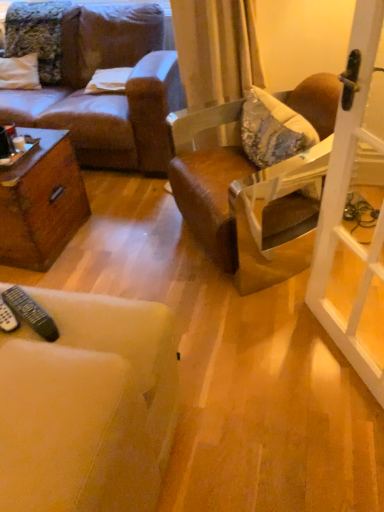
Question: From the image's perspective, would you say brown leather chair at center is positioned over white fabric pillow at upper center?

Choices:
 (A) no
 (B) yes

Answer: (A)

Question: Can white fabric pillow at upper center be found inside brown leather chair at center?

Choices:
 (A) yes
 (B) no

Answer: (B)

Question: Is brown leather chair at center closer to camera compared to white fabric pillow at upper center?

Choices:
 (A) yes
 (B) no

Answer: (A)

Question: Considering the relative positions of brown leather chair at center and white fabric pillow at upper center in the image provided, is brown leather chair at center to the right of white fabric pillow at upper center from the viewer's perspective?

Choices:
 (A) no
 (B) yes

Answer: (B)

Question: From a real-world perspective, is brown leather chair at center positioned over white fabric pillow at upper center based on gravity?

Choices:
 (A) yes
 (B) no

Answer: (B)

Question: Considering their positions, is black plastic remote control at lower left, which is counted as the first remote control, starting from the left, located in front of or behind white glass screen door at right?

Choices:
 (A) behind
 (B) front

Answer: (A)

Question: Considering the positions of black plastic remote control at lower left, the second remote control in the right-to-left sequence, and white glass screen door at right in the image, is black plastic remote control at lower left, the second remote control in the right-to-left sequence, bigger or smaller than white glass screen door at right?

Choices:
 (A) small
 (B) big

Answer: (A)

Question: Considering the positions of point (11, 320) and point (374, 25), is point (11, 320) closer or farther from the camera than point (374, 25)?

Choices:
 (A) closer
 (B) farther

Answer: (B)

Question: Based on their positions, is black plastic remote control at lower left, which is counted as the first remote control, starting from the left, located to the left or right of white glass screen door at right?

Choices:
 (A) right
 (B) left

Answer: (B)

Question: Would you say white fabric pillow at upper center is to the left or to the right of black plastic remote control at lower left, the second remote control in the right-to-left sequence, in the picture?

Choices:
 (A) left
 (B) right

Answer: (B)

Question: In terms of size, does white fabric pillow at upper center appear bigger or smaller than black plastic remote control at lower left, which is counted as the first remote control, starting from the left?

Choices:
 (A) big
 (B) small

Answer: (A)

Question: From a real-world perspective, is white fabric pillow at upper center physically located above or below black plastic remote control at lower left, the second remote control in the right-to-left sequence?

Choices:
 (A) below
 (B) above

Answer: (A)

Question: Is white fabric pillow at upper center wider or thinner than black plastic remote control at lower left, the second remote control in the right-to-left sequence?

Choices:
 (A) wide
 (B) thin

Answer: (A)

Question: Is black plastic remote at lower left, which ranks as the second remote control in left-to-right order, bigger or smaller than brown leather chair at center?

Choices:
 (A) small
 (B) big

Answer: (A)

Question: Considering their positions, is black plastic remote at lower left, arranged as the first remote control when viewed from the right, located in front of or behind brown leather chair at center?

Choices:
 (A) behind
 (B) front

Answer: (B)